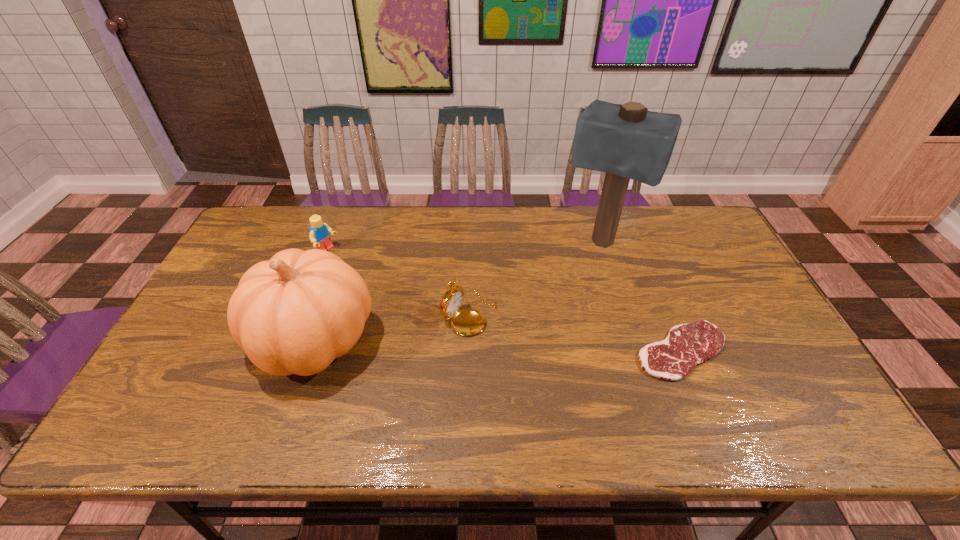
Where is `free spot on the desktop that is between the pumpkin and the shortest object and is positioned on the striking surface of the mallet`? This screenshot has height=540, width=960. free spot on the desktop that is between the pumpkin and the shortest object and is positioned on the striking surface of the mallet is located at coordinates (548, 347).

Where is `vacant space on the desktop that is between the fourth shortest object and the shortest object and is positioned on the front-facing side of the Lego`? vacant space on the desktop that is between the fourth shortest object and the shortest object and is positioned on the front-facing side of the Lego is located at coordinates (494, 346).

At what (x,y) coordinates should I click in order to perform the action: click on vacant spot on the desktop that is between the pumpkin and the shortest object and is positioned on the face of the pocket watch. Please return your answer as a coordinate pair (x, y). Looking at the image, I should click on (537, 347).